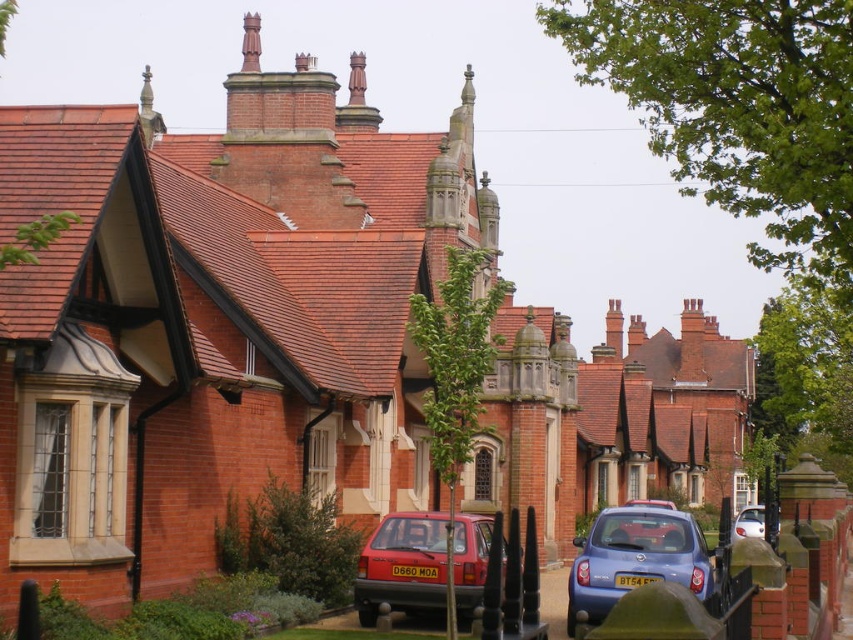
Question: Which of the following is the farthest from the observer?

Choices:
 (A) (625, 500)
 (B) (700, 547)
 (C) (744, 509)
 (D) (390, 582)

Answer: (A)

Question: Can you confirm if metallic blue hatchback at lower right is smaller than matte red car at center?

Choices:
 (A) yes
 (B) no

Answer: (B)

Question: Which object is the closest to the white glossy car at lower right?

Choices:
 (A) matte red hatchback at center
 (B) metallic blue hatchback at lower right
 (C) matte red car at center

Answer: (C)

Question: Can you confirm if matte red hatchback at center is smaller than metallic blue hatchback at lower right?

Choices:
 (A) yes
 (B) no

Answer: (A)

Question: Which of the following is the farthest from the observer?

Choices:
 (A) (761, 509)
 (B) (569, 577)
 (C) (653, 500)
 (D) (436, 595)

Answer: (A)

Question: Can you confirm if matte red hatchback at center is positioned to the right of metallic blue hatchback at lower right?

Choices:
 (A) yes
 (B) no

Answer: (B)